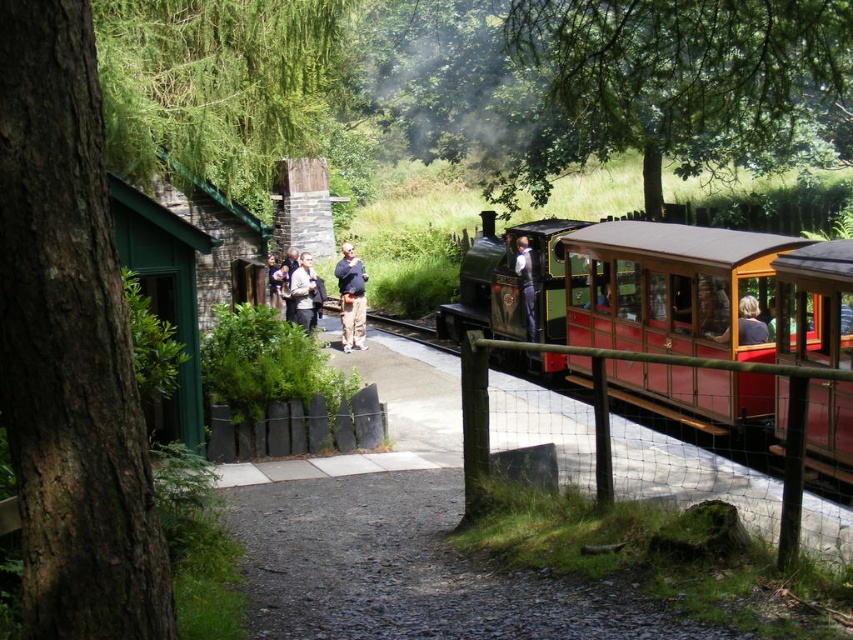
Question: Is dark blue jeans at center further to the viewer compared to light blue shirt at center?

Choices:
 (A) no
 (B) yes

Answer: (B)

Question: Estimate the real-world distances between objects in this image. Which object is closer to the green polished wood train at center?

Choices:
 (A) matte brown hair at right
 (B) dark blue jeans at center
 (C) light brown leather jacket at center

Answer: (A)

Question: Among these points, which one is nearest to the camera?

Choices:
 (A) (743, 312)
 (B) (345, 323)
 (C) (816, 317)

Answer: (C)

Question: Does light brown leather jacket at center lie behind matte brown hair at right?

Choices:
 (A) no
 (B) yes

Answer: (B)

Question: Can you confirm if green polished wood train at center is positioned above dark blue jeans at center?

Choices:
 (A) yes
 (B) no

Answer: (B)

Question: Estimate the real-world distances between objects in this image. Which object is farther from the light brown leather jacket at center?

Choices:
 (A) dark blue jeans at center
 (B) light blue shirt at center
 (C) matte brown hair at right

Answer: (C)